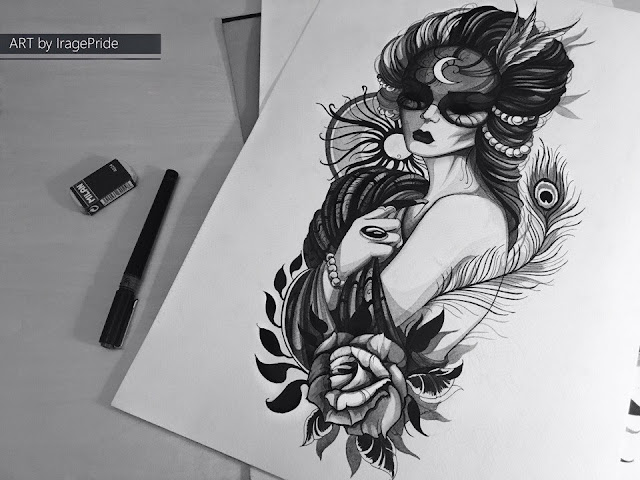
The height and width of the screenshot is (480, 640). Find the location of `drawing table`. drawing table is located at coordinates (192, 137).